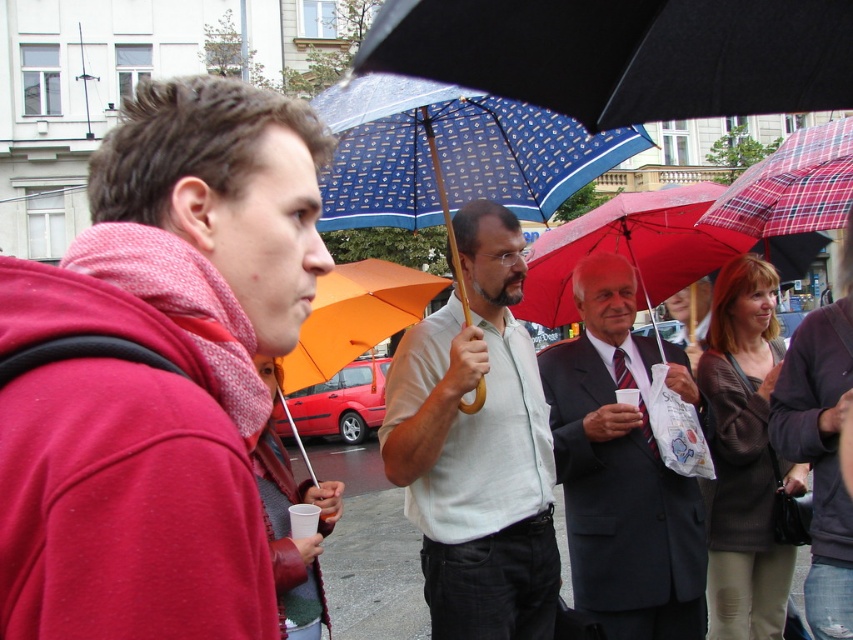
You are standing in the scene and want to take a photo of both the person in the red hoodie and the man in the light shirt. The person in the red hoodie is at point [550,156] and the man in the light shirt is at point [792,566]. Since you want both in focus, which point should you focus on?

You should focus on point [550,156] because it is closer to the camera than point [792,566]. This way, the person in the red hoodie will be in focus, and the man in the light shirt may also be in focus depending on the depth of field.

You are a photographer trying to capture a detailed shot of the matte red hoodie at left and the blue printed umbrella at center. Since you want both objects to appear equally prominent in the photo, which object should you zoom in on more?

The matte red hoodie at left is smaller in size than the blue printed umbrella at center. To make both appear equally prominent, you should zoom in more on the matte red hoodie at left to compensate for its smaller size.